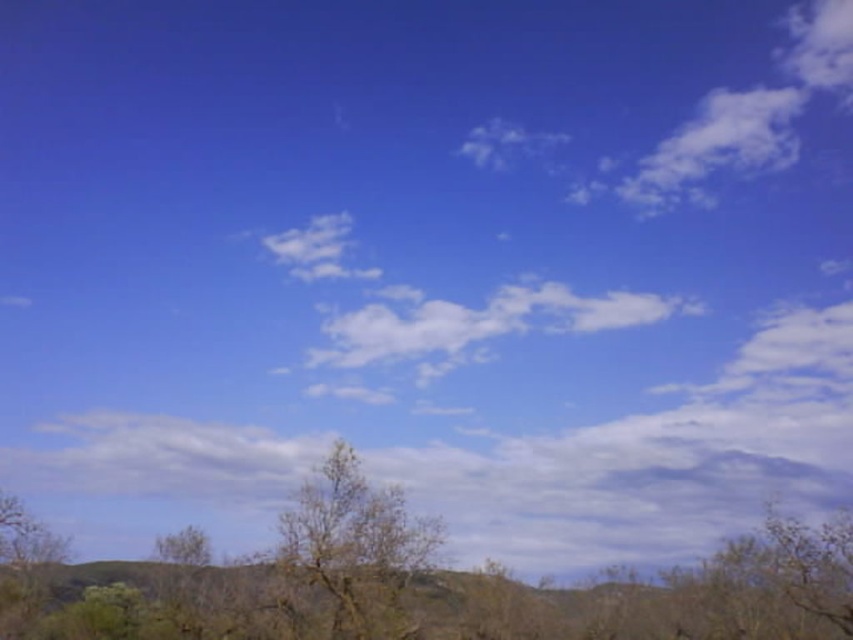
You are an environmental scientist assessing the landscape. You notice the brown textured tree at center and the bare wood tree at lower left. Based on their positions in the image, which tree would you estimate is closer to the ground?

The brown textured tree at center is located above the bare wood tree at lower left, so the bare wood tree at lower left is closer to the ground.

You are planning to plant a new tree in your backyard. You have two options based on the image provided. The brown textured tree at center and the bare wood tree at lower left. Which tree has a wider trunk? Please refer to the image for details.

The brown textured tree at center has a larger width than the bare wood tree at lower left, so it has a wider trunk.